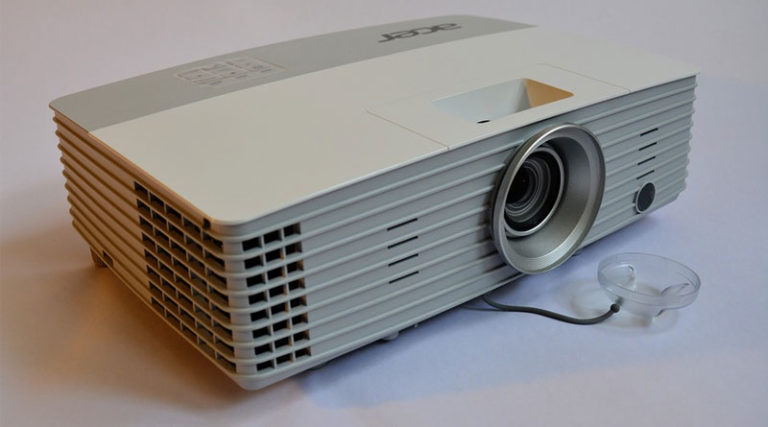
What are the coordinates of `air vents` in the screenshot? It's located at (177, 234), (177, 290), (197, 336), (292, 344), (276, 304), (276, 273), (273, 246).